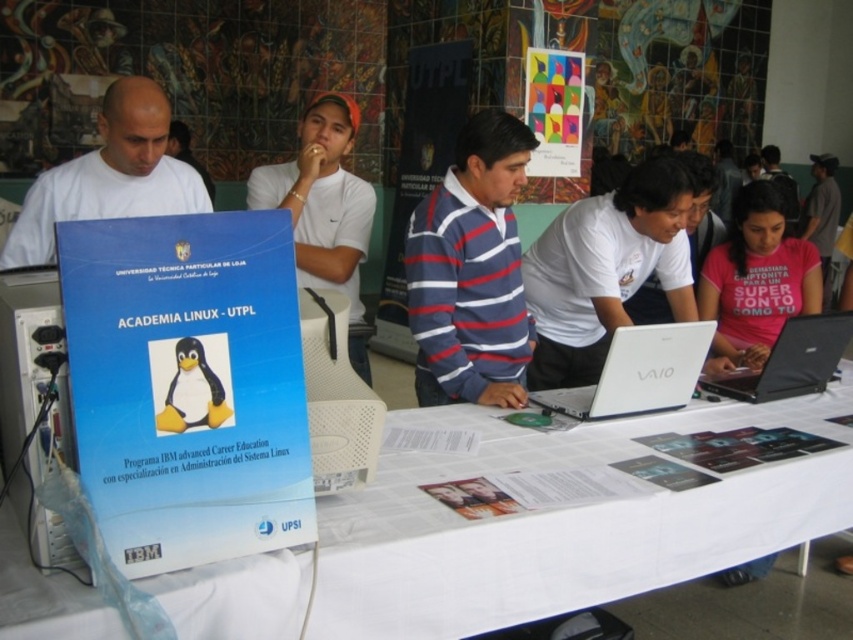
Question: Where is white matte shirt at center located in relation to black matte laptop at lower right in the image?

Choices:
 (A) above
 (B) below

Answer: (A)

Question: Does white matte shirt at center appear on the left side of white matte t-shirt at center?

Choices:
 (A) no
 (B) yes

Answer: (A)

Question: Estimate the real-world distances between objects in this image. Which object is closer to the colorful paper poster at upper center?

Choices:
 (A) white plastic computer tower at center
 (B) white matte t-shirt at center
 (C) blue striped shirt at center

Answer: (B)

Question: Among these points, which one is nearest to the camera?

Choices:
 (A) (848, 496)
 (B) (691, 365)

Answer: (A)

Question: Among these points, which one is farthest from the camera?

Choices:
 (A) (207, 410)
 (B) (744, 378)
 (C) (495, 157)
 (D) (761, 324)

Answer: (D)

Question: Does white matte t-shirt at center have a larger size compared to colorful paper poster at upper center?

Choices:
 (A) yes
 (B) no

Answer: (A)